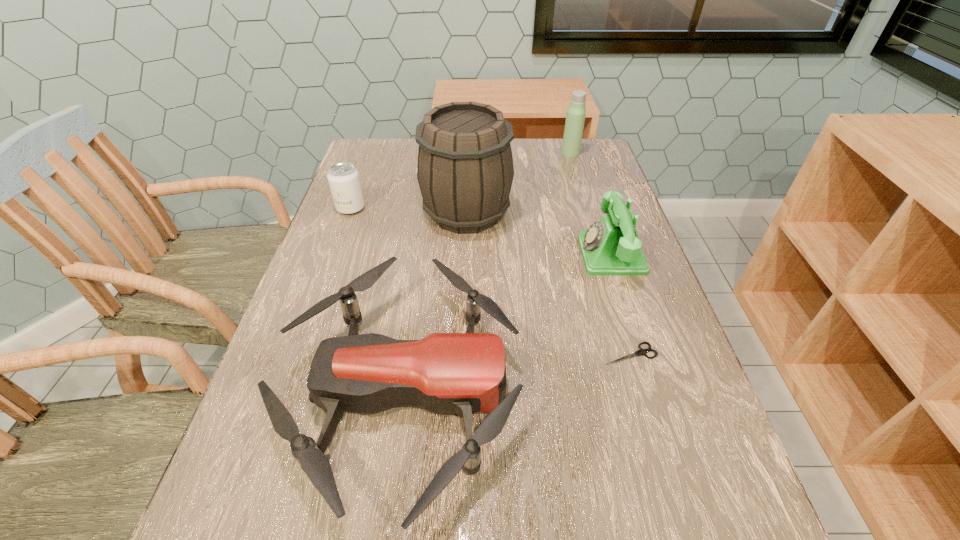
Where is `free space located 0.180m on the dial of the telephone`? This screenshot has width=960, height=540. free space located 0.180m on the dial of the telephone is located at coordinates [x=505, y=255].

In order to click on free space located on the right of the soda can in this screenshot , I will do `click(485, 208)`.

Find the location of `free region located on the left of the shears`. free region located on the left of the shears is located at coordinates (408, 354).

Where is `object present at the far edge`? The width and height of the screenshot is (960, 540). object present at the far edge is located at coordinates (575, 117).

Identify the location of object that is at the left edge. (344, 181).

This screenshot has height=540, width=960. Identify the location of thermos bottle present at the right edge. (575, 117).

You are a GUI agent. You are given a task and a screenshot of the screen. Output one action in this format:
    pyautogui.click(x=<x>, y=<y>)
    Task: Click on the telephone at the right edge
    The height and width of the screenshot is (540, 960).
    Given the screenshot: What is the action you would take?
    pyautogui.click(x=610, y=246)

I want to click on shears present at the right edge, so click(x=641, y=351).

Locate an element on the screen. Image resolution: width=960 pixels, height=540 pixels. object at the far right corner is located at coordinates (575, 117).

This screenshot has width=960, height=540. In the image, there is a desktop. Identify the location of vacant space at the left edge. (337, 230).